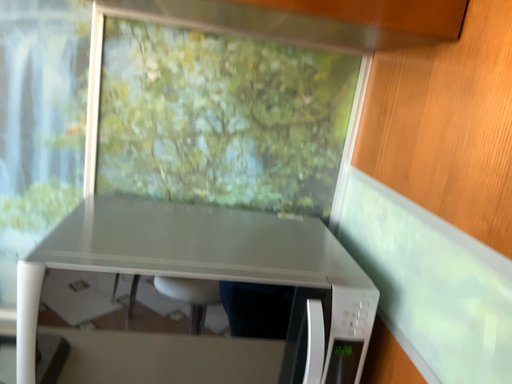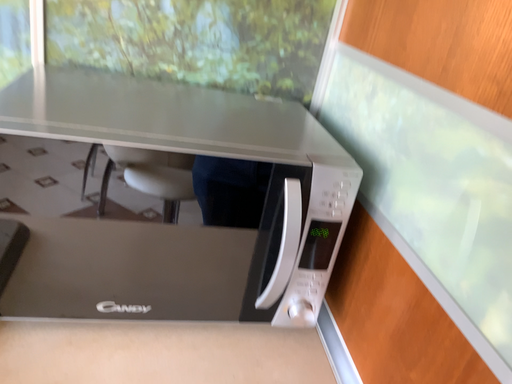
Question: Which way did the camera rotate in the video?

Choices:
 (A) rotated upward
 (B) rotated downward

Answer: (B)